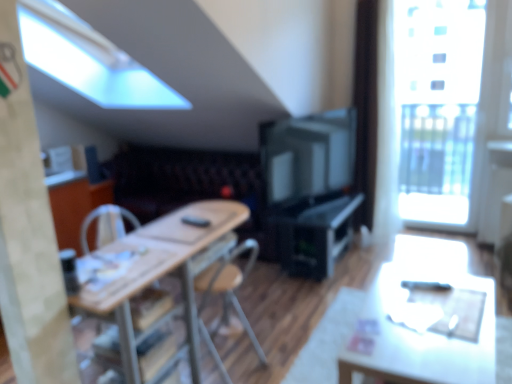
Question: Does black plastic computer desk at center have a larger size compared to transparent glass window at upper right?

Choices:
 (A) no
 (B) yes

Answer: (B)

Question: Can you confirm if black plastic computer desk at center is wider than transparent glass window at upper right?

Choices:
 (A) no
 (B) yes

Answer: (B)

Question: Is the depth of black plastic computer desk at center less than that of transparent glass window at upper right?

Choices:
 (A) no
 (B) yes

Answer: (B)

Question: From a real-world perspective, is black plastic computer desk at center located higher than transparent glass window at upper right?

Choices:
 (A) yes
 (B) no

Answer: (B)

Question: Is black plastic computer desk at center not near transparent glass window at upper right?

Choices:
 (A) no
 (B) yes

Answer: (B)

Question: Is velvet dark brown couch at center in front of or behind matte white table at lower right in the image?

Choices:
 (A) behind
 (B) front

Answer: (A)

Question: Would you say velvet dark brown couch at center is inside or outside matte white table at lower right?

Choices:
 (A) inside
 (B) outside

Answer: (B)

Question: From the image's perspective, is velvet dark brown couch at center positioned above or below matte white table at lower right?

Choices:
 (A) below
 (B) above

Answer: (B)

Question: From a real-world perspective, is velvet dark brown couch at center physically located above or below matte white table at lower right?

Choices:
 (A) above
 (B) below

Answer: (A)

Question: Is point (291, 195) positioned closer to the camera than point (222, 218)?

Choices:
 (A) farther
 (B) closer

Answer: (A)

Question: In terms of width, does matte black television at center look wider or thinner when compared to wooden table at center?

Choices:
 (A) wide
 (B) thin

Answer: (B)

Question: Considering the positions of matte black television at center and wooden table at center in the image, is matte black television at center bigger or smaller than wooden table at center?

Choices:
 (A) big
 (B) small

Answer: (A)

Question: Is matte black television at center taller or shorter than wooden table at center?

Choices:
 (A) tall
 (B) short

Answer: (A)

Question: Relative to matte white table at lower right, is black plastic remote control at center in front or behind?

Choices:
 (A) behind
 (B) front

Answer: (A)

Question: In terms of width, does black plastic remote control at center look wider or thinner when compared to matte white table at lower right?

Choices:
 (A) thin
 (B) wide

Answer: (A)